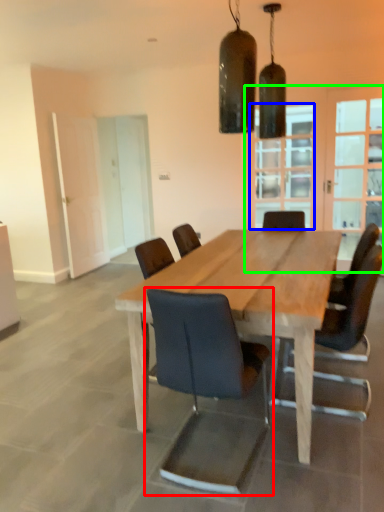
Question: Considering the real-world distances, which object is closest to chair (highlighted by a red box)? window (highlighted by a blue box) or glass door (highlighted by a green box).

Choices:
 (A) window
 (B) glass door

Answer: (B)